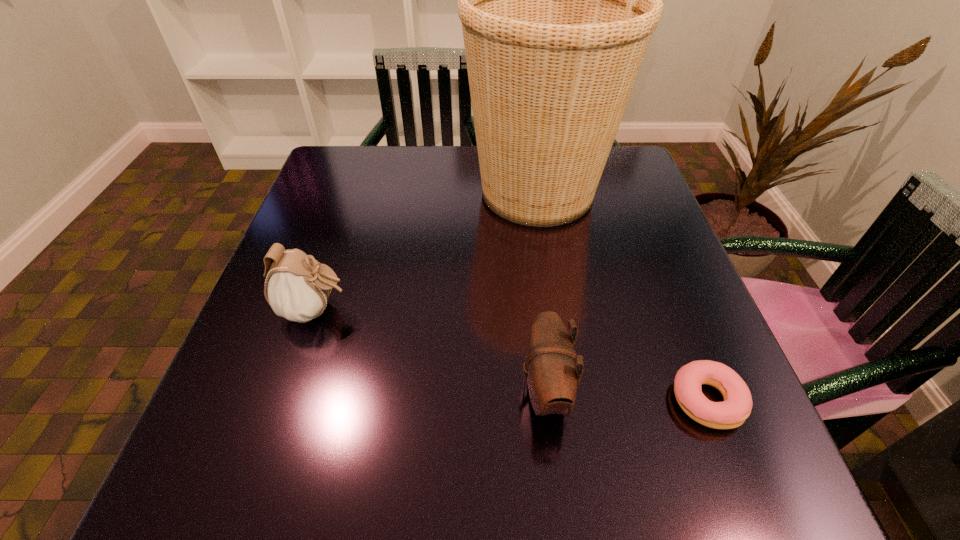
I want to click on the tallest object, so click(x=558, y=0).

Image resolution: width=960 pixels, height=540 pixels. Identify the location of basket. (558, 0).

Where is `the third nearest object`? This screenshot has width=960, height=540. the third nearest object is located at coordinates (298, 289).

Locate an element on the screen. the leftmost object is located at coordinates (298, 289).

Where is `the nearer pouch`? This screenshot has width=960, height=540. the nearer pouch is located at coordinates (551, 367).

I want to click on the shortest object, so click(x=731, y=413).

Locate an element on the screen. The height and width of the screenshot is (540, 960). free space located 0.310m on the front of the tallest object is located at coordinates (563, 357).

Locate an element on the screen. The height and width of the screenshot is (540, 960). free space located on the front-facing side of the left pouch is located at coordinates [x=378, y=310].

Locate an element on the screen. free region located with the flap open on the right pouch is located at coordinates (448, 390).

At what (x,y) coordinates should I click in order to perform the action: click on free location located 0.370m with the flap open on the right pouch. Please return your answer as a coordinate pair (x, y). Looking at the image, I should click on (297, 390).